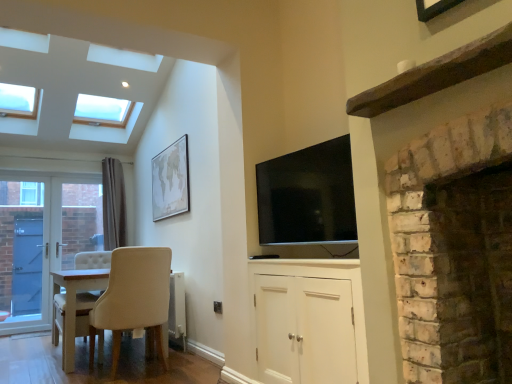
Question: From the image's perspective, is flat screen tv at upper center over white wooden door at left?

Choices:
 (A) yes
 (B) no

Answer: (A)

Question: From a real-world perspective, is flat screen tv at upper center positioned over white wooden door at left based on gravity?

Choices:
 (A) yes
 (B) no

Answer: (A)

Question: Does flat screen tv at upper center have a lesser height compared to white wooden door at left?

Choices:
 (A) no
 (B) yes

Answer: (B)

Question: Considering the relative sizes of flat screen tv at upper center and white wooden door at left in the image provided, is flat screen tv at upper center thinner than white wooden door at left?

Choices:
 (A) no
 (B) yes

Answer: (A)

Question: Is flat screen tv at upper center positioned behind white wooden door at left?

Choices:
 (A) no
 (B) yes

Answer: (A)

Question: Can you confirm if flat screen tv at upper center is positioned to the left of white wooden door at left?

Choices:
 (A) no
 (B) yes

Answer: (A)

Question: Does white wooden door at left have a smaller size compared to white brick fireplace at right?

Choices:
 (A) yes
 (B) no

Answer: (A)

Question: From a real-world perspective, is white wooden door at left below white brick fireplace at right?

Choices:
 (A) yes
 (B) no

Answer: (B)

Question: Can you confirm if white wooden door at left is shorter than white brick fireplace at right?

Choices:
 (A) yes
 (B) no

Answer: (B)

Question: Would you consider white wooden door at left to be distant from white brick fireplace at right?

Choices:
 (A) no
 (B) yes

Answer: (B)

Question: Can you confirm if white wooden door at left is wider than white brick fireplace at right?

Choices:
 (A) yes
 (B) no

Answer: (B)

Question: From the image's perspective, is white wooden door at left located above white brick fireplace at right?

Choices:
 (A) yes
 (B) no

Answer: (B)

Question: Is flat screen tv at upper center not inside beige matte map at upper center?

Choices:
 (A) yes
 (B) no

Answer: (A)